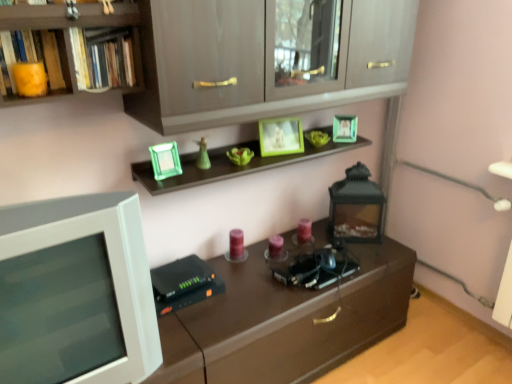
Question: Considering the positions of matte yellow book at upper left, placed as the 1th book when sorted from left to right, and hardcover books at upper left, placed as the second book when sorted from left to right, in the image, is matte yellow book at upper left, placed as the 1th book when sorted from left to right, wider or thinner than hardcover books at upper left, placed as the second book when sorted from left to right,?

Choices:
 (A) thin
 (B) wide

Answer: (A)

Question: Is point (57, 74) positioned closer to the camera than point (118, 84)?

Choices:
 (A) farther
 (B) closer

Answer: (B)

Question: Based on their relative distances, which object is farther from the black matte lantern at center-right?

Choices:
 (A) matte yellow book at upper left, placed as the 1th book when sorted from left to right
 (B) matte gray cabinet at upper center
 (C) white plastic computer monitor at left
 (D) hardcover books at upper left, which is the 1th book from right to left

Answer: (A)

Question: Which is farther from the white plastic computer monitor at left?

Choices:
 (A) hardcover books at upper left, placed as the second book when sorted from left to right
 (B) matte gray cabinet at upper center
 (C) matte yellow book at upper left, the second book viewed from the right
 (D) black matte lantern at center-right

Answer: (D)